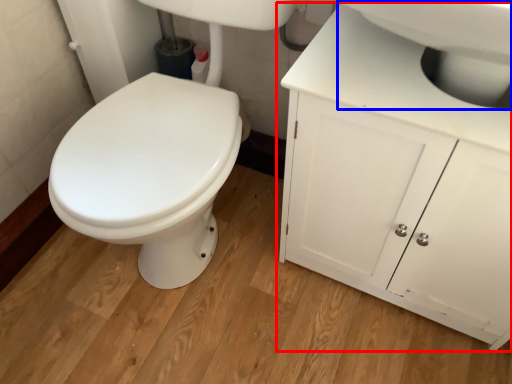
Question: Among these objects, which one is nearest to the camera, bathroom cabinet (highlighted by a red box) or sink (highlighted by a blue box)?

Choices:
 (A) bathroom cabinet
 (B) sink

Answer: (B)